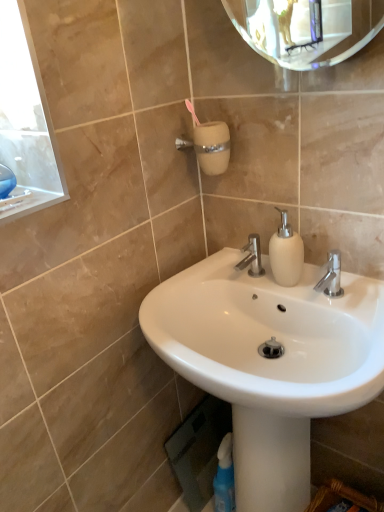
Question: Does white glossy sink at center lie in front of white matte soap dispenser at center?

Choices:
 (A) no
 (B) yes

Answer: (B)

Question: Considering the relative sizes of white glossy sink at center and white matte soap dispenser at center in the image provided, is white glossy sink at center smaller than white matte soap dispenser at center?

Choices:
 (A) no
 (B) yes

Answer: (A)

Question: Is white glossy sink at center looking in the opposite direction of white matte soap dispenser at center?

Choices:
 (A) no
 (B) yes

Answer: (A)

Question: Is white glossy sink at center positioned beyond the bounds of white matte soap dispenser at center?

Choices:
 (A) no
 (B) yes

Answer: (B)

Question: Considering the relative sizes of white glossy sink at center and white matte soap dispenser at center in the image provided, is white glossy sink at center thinner than white matte soap dispenser at center?

Choices:
 (A) no
 (B) yes

Answer: (A)

Question: Is white glossy sink at center bigger or smaller than white matte soap dispenser at center?

Choices:
 (A) big
 (B) small

Answer: (A)

Question: In terms of height, does white glossy sink at center look taller or shorter compared to white matte soap dispenser at center?

Choices:
 (A) tall
 (B) short

Answer: (A)

Question: From the image's perspective, is white glossy sink at center above or below white matte soap dispenser at center?

Choices:
 (A) above
 (B) below

Answer: (B)

Question: From a real-world perspective, is white glossy sink at center above or below white matte soap dispenser at center?

Choices:
 (A) below
 (B) above

Answer: (A)

Question: In terms of width, does white glossy sink at center look wider or thinner when compared to polished chrome faucet at center?

Choices:
 (A) thin
 (B) wide

Answer: (B)

Question: Is point (279, 437) closer or farther from the camera than point (256, 254)?

Choices:
 (A) closer
 (B) farther

Answer: (A)

Question: From the image's perspective, relative to polished chrome faucet at center, is white glossy sink at center above or below?

Choices:
 (A) above
 (B) below

Answer: (B)

Question: From a real-world perspective, relative to polished chrome faucet at center, is white glossy sink at center vertically above or below?

Choices:
 (A) below
 (B) above

Answer: (A)

Question: Would you say white matte soap dispenser at center is inside or outside white glossy sink at center?

Choices:
 (A) outside
 (B) inside

Answer: (A)

Question: Is white matte soap dispenser at center wider or thinner than white glossy sink at center?

Choices:
 (A) wide
 (B) thin

Answer: (B)